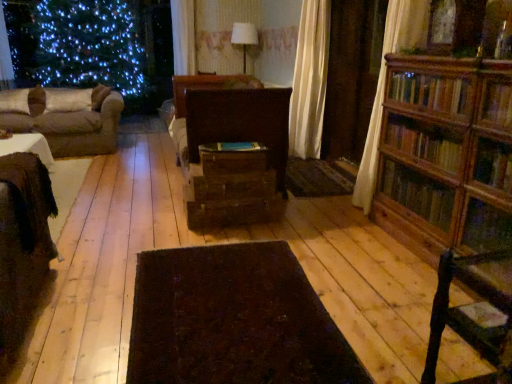
Question: From a real-world perspective, is green fabric curtain at upper left over brown fabric couch at left?

Choices:
 (A) no
 (B) yes

Answer: (B)

Question: From a real-world perspective, is green fabric curtain at upper left located beneath brown fabric couch at left?

Choices:
 (A) no
 (B) yes

Answer: (A)

Question: Considering the relative sizes of green fabric curtain at upper left and brown fabric couch at left in the image provided, is green fabric curtain at upper left bigger than brown fabric couch at left?

Choices:
 (A) no
 (B) yes

Answer: (A)

Question: Considering the relative sizes of green fabric curtain at upper left and brown fabric couch at left in the image provided, is green fabric curtain at upper left shorter than brown fabric couch at left?

Choices:
 (A) no
 (B) yes

Answer: (A)

Question: Is green fabric curtain at upper left next to brown fabric couch at left and touching it?

Choices:
 (A) no
 (B) yes

Answer: (A)

Question: Is green fabric curtain at upper left to the left or to the right of dark brown wooden chair at lower right in the image?

Choices:
 (A) right
 (B) left

Answer: (B)

Question: Relative to dark brown wooden chair at lower right, is green fabric curtain at upper left in front or behind?

Choices:
 (A) behind
 (B) front

Answer: (A)

Question: From a real-world perspective, relative to dark brown wooden chair at lower right, is green fabric curtain at upper left vertically above or below?

Choices:
 (A) below
 (B) above

Answer: (B)

Question: Is green fabric curtain at upper left inside the boundaries of dark brown wooden chair at lower right, or outside?

Choices:
 (A) inside
 (B) outside

Answer: (B)

Question: In the image, is dark wool rug at center positioned in front of or behind brown wood drawer at center, marked as the first drawer in a bottom-to-top arrangement?

Choices:
 (A) front
 (B) behind

Answer: (A)

Question: From a real-world perspective, is dark wool rug at center physically located above or below brown wood drawer at center, positioned as the 2th drawer in top-to-bottom order?

Choices:
 (A) above
 (B) below

Answer: (B)

Question: Do you think dark wool rug at center is within brown wood drawer at center, marked as the first drawer in a bottom-to-top arrangement, or outside of it?

Choices:
 (A) outside
 (B) inside

Answer: (A)

Question: Is point pos(198,248) positioned closer to the camera than point pos(274,185)?

Choices:
 (A) farther
 (B) closer

Answer: (B)

Question: In the image, is dark wool rug at center positioned in front of or behind wooden bookcase at right?

Choices:
 (A) behind
 (B) front

Answer: (B)

Question: Is dark wool rug at center bigger or smaller than wooden bookcase at right?

Choices:
 (A) small
 (B) big

Answer: (A)